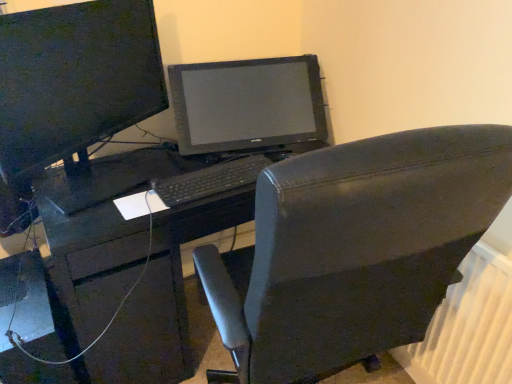
Image resolution: width=512 pixels, height=384 pixels. I want to click on blank area beneath black plastic keyboard at center (from a real-world perspective), so click(212, 178).